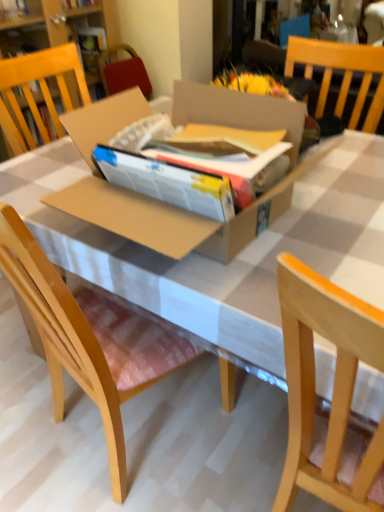
Question: Is light wood chair at right, acting as the 1th chair starting from the right, situated inside wooden chair at center, which ranks as the first chair in left-to-right order, or outside?

Choices:
 (A) outside
 (B) inside

Answer: (A)

Question: Does point (372, 334) appear closer or farther from the camera than point (66, 309)?

Choices:
 (A) closer
 (B) farther

Answer: (A)

Question: Considering the real-world distances, which object is farthest from the brown cardboard box at center?

Choices:
 (A) wooden chair at center, which is the 2th chair in right-to-left order
 (B) brown cardboard box at center
 (C) light wood chair at right, the 2th chair from the left

Answer: (C)

Question: Which object is positioned closest to the brown cardboard box at center?

Choices:
 (A) brown cardboard box at center
 (B) light wood chair at right, acting as the 1th chair starting from the right
 (C) wooden chair at center, which ranks as the first chair in left-to-right order

Answer: (A)